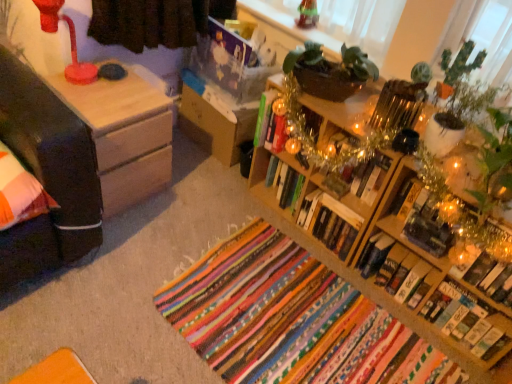
Question: From a real-world perspective, is wooden nightstand at center physically below green matte cactus at upper right?

Choices:
 (A) yes
 (B) no

Answer: (A)

Question: Considering the relative sizes of wooden nightstand at center and green matte cactus at upper right in the image provided, is wooden nightstand at center smaller than green matte cactus at upper right?

Choices:
 (A) no
 (B) yes

Answer: (A)

Question: From a real-world perspective, is wooden nightstand at center on top of green matte cactus at upper right?

Choices:
 (A) no
 (B) yes

Answer: (A)

Question: Is wooden nightstand at center in front of green matte cactus at upper right?

Choices:
 (A) yes
 (B) no

Answer: (B)

Question: Can you confirm if wooden nightstand at center is bigger than green matte cactus at upper right?

Choices:
 (A) no
 (B) yes

Answer: (B)

Question: Is the depth of wooden nightstand at center greater than that of green matte cactus at upper right?

Choices:
 (A) no
 (B) yes

Answer: (B)

Question: Is green matte cactus at upper right smaller than hardcover book at lower right, which appears as the sixth book when viewed from the left?

Choices:
 (A) yes
 (B) no

Answer: (B)

Question: Is green matte cactus at upper right shorter than hardcover book at lower right, placed as the second book when sorted from right to left?

Choices:
 (A) no
 (B) yes

Answer: (A)

Question: From a real-world perspective, is green matte cactus at upper right physically below hardcover book at lower right, which appears as the sixth book when viewed from the left?

Choices:
 (A) no
 (B) yes

Answer: (A)

Question: Is green matte cactus at upper right with hardcover book at lower right, placed as the second book when sorted from right to left?

Choices:
 (A) no
 (B) yes

Answer: (A)

Question: Can you confirm if green matte cactus at upper right is positioned to the right of hardcover book at lower right, which appears as the sixth book when viewed from the left?

Choices:
 (A) no
 (B) yes

Answer: (A)

Question: Is the position of green matte cactus at upper right more distant than that of hardcover book at lower right, which appears as the sixth book when viewed from the left?

Choices:
 (A) no
 (B) yes

Answer: (A)

Question: Is multicolored woven rug at center turned away from wooden bookshelf at right?

Choices:
 (A) yes
 (B) no

Answer: (B)